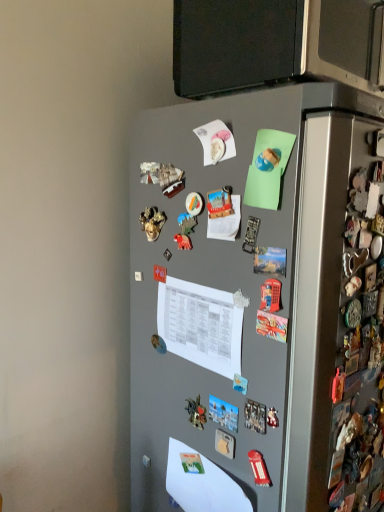
Question: From a real-world perspective, is white paper at center, which is the second paper in bottom-to-top order, located beneath white paper at lower center, which is the 1th paper in bottom-to-top order?

Choices:
 (A) yes
 (B) no

Answer: (B)

Question: Is white paper at center, positioned as the first paper in top-to-bottom order, bigger than white paper at lower center, which is the 1th paper in bottom-to-top order?

Choices:
 (A) no
 (B) yes

Answer: (A)

Question: Considering the relative sizes of white paper at center, positioned as the first paper in top-to-bottom order, and white paper at lower center, which is the 1th paper in bottom-to-top order, in the image provided, is white paper at center, positioned as the first paper in top-to-bottom order, smaller than white paper at lower center, which is the 1th paper in bottom-to-top order,?

Choices:
 (A) yes
 (B) no

Answer: (A)

Question: Does white paper at center, which is the second paper in bottom-to-top order, have a greater height compared to white paper at lower center, arranged as the 2th paper when viewed from the top?

Choices:
 (A) yes
 (B) no

Answer: (A)

Question: Does white paper at center, positioned as the first paper in top-to-bottom order, have a lesser width compared to white paper at lower center, which is the 1th paper in bottom-to-top order?

Choices:
 (A) no
 (B) yes

Answer: (B)

Question: Is white paper at center, which is the second paper in bottom-to-top order, outside white paper at lower center, arranged as the 2th paper when viewed from the top?

Choices:
 (A) yes
 (B) no

Answer: (A)

Question: Would you say gray matte refrigerator at center is a long distance from satin black microwave at upper center?

Choices:
 (A) no
 (B) yes

Answer: (A)

Question: From the image's perspective, is gray matte refrigerator at center on top of satin black microwave at upper center?

Choices:
 (A) no
 (B) yes

Answer: (A)

Question: Would you say gray matte refrigerator at center is outside satin black microwave at upper center?

Choices:
 (A) yes
 (B) no

Answer: (A)

Question: From a real-world perspective, is gray matte refrigerator at center positioned under satin black microwave at upper center based on gravity?

Choices:
 (A) yes
 (B) no

Answer: (A)

Question: Is gray matte refrigerator at center in front of satin black microwave at upper center?

Choices:
 (A) yes
 (B) no

Answer: (A)

Question: Is gray matte refrigerator at center oriented away from satin black microwave at upper center?

Choices:
 (A) no
 (B) yes

Answer: (A)

Question: Does satin black microwave at upper center appear on the right side of white paper at center, positioned as the first paper in top-to-bottom order?

Choices:
 (A) no
 (B) yes

Answer: (B)